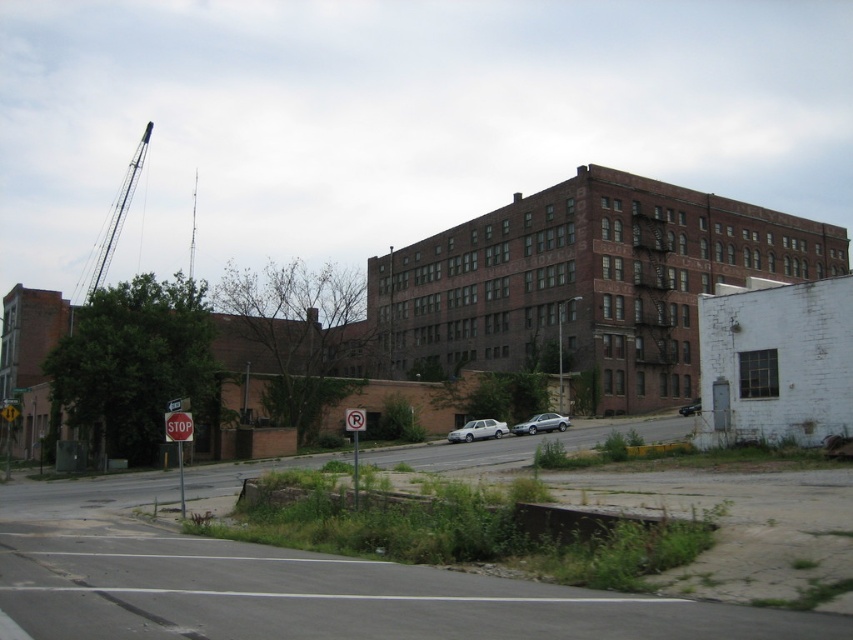
You are standing at the point with coordinates point (x=117, y=214). What object is located at this point?

The metallic gray crane at upper left is located at point (x=117, y=214).

Consider the image. You are standing at the point marked by point [178,426]. Which object are you standing on?

You are standing on the red painted metal stop sign at center, as the point [178,426] represents this object.

You are standing at the street corner in front of the abandoned building. You notice two points marked on the ground. One is at point (171, 412) and the other is at point (695, 408). Which point is closer to you?

Point (171, 412) is closer to the camera than point (695, 408), so the point at (171, 412) is closer to you.